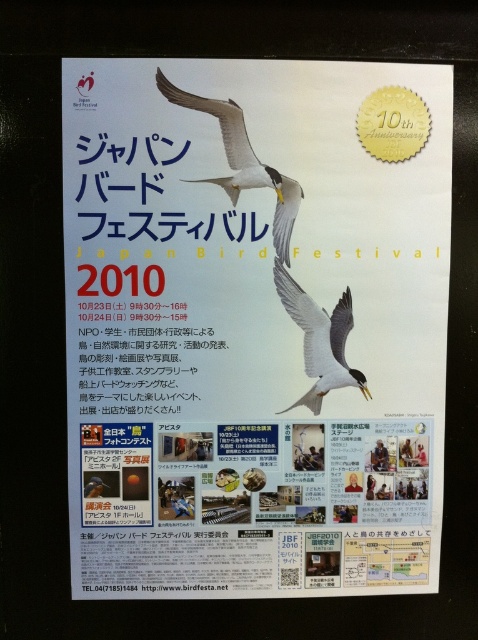
Is white paper poster at upper center bigger than white glossy seagull at upper center?

Correct, white paper poster at upper center is larger in size than white glossy seagull at upper center.

Does white paper poster at upper center appear under white glossy seagull at upper center?

Yes.

Is point (417, 96) farther from viewer compared to point (248, 160)?

Yes, point (417, 96) is farther from viewer.

Where is `white paper poster at upper center`? This screenshot has height=640, width=478. white paper poster at upper center is located at coordinates (254, 324).

Between white paper poster at upper center and white glossy bird at center, which one has more height?

With more height is white paper poster at upper center.

In the scene shown: Can you confirm if white paper poster at upper center is wider than white glossy bird at center?

Yes, white paper poster at upper center is wider than white glossy bird at center.

Is point (162, 541) closer to viewer compared to point (319, 394)?

No.

Locate an element on the screen. The image size is (478, 640). white paper poster at upper center is located at coordinates (254, 324).

Is white glossy seagull at upper center to the left of white glossy bird at center from the viewer's perspective?

Correct, you'll find white glossy seagull at upper center to the left of white glossy bird at center.

The image size is (478, 640). What are the coordinates of `white glossy seagull at upper center` in the screenshot? It's located at (242, 161).